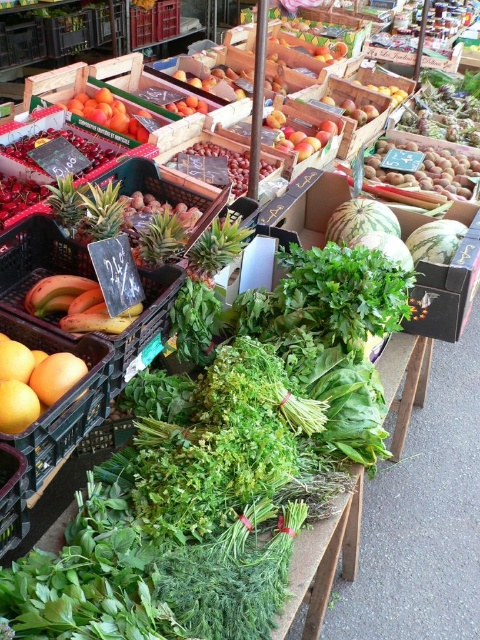
Which of these two, smooth orange tangerines at center or shiny red grapes at center, stands shorter?

smooth orange tangerines at center is shorter.

Who is positioned more to the left, smooth orange tangerines at center or shiny red grapes at center?

From the viewer's perspective, smooth orange tangerines at center appears more on the left side.

Measure the distance between point (78, 99) and camera.

A distance of 7.77 feet exists between point (78, 99) and camera.

At what (x,y) coordinates should I click in order to perform the action: click on smooth orange tangerines at center. Please return your answer as a coordinate pair (x, y). The image size is (480, 640). Looking at the image, I should click on coord(109,113).

This screenshot has height=640, width=480. What do you see at coordinates (424, 168) in the screenshot?
I see `smooth brown nuts at upper right` at bounding box center [424, 168].

Does smooth brown nuts at upper right appear on the right side of green leafy vegetable at center?

Indeed, smooth brown nuts at upper right is positioned on the right side of green leafy vegetable at center.

Is point (418, 186) behind point (36, 196)?

Yes, it is.

The image size is (480, 640). Find the location of `smooth brown nuts at upper right`. smooth brown nuts at upper right is located at coordinates (424, 168).

How distant is smooth brown nuts at upper right from smooth orange at center?

The distance of smooth brown nuts at upper right from smooth orange at center is 3.39 feet.

Who is more forward, (454, 180) or (193, 100)?

Point (454, 180)

You are a GUI agent. You are given a task and a screenshot of the screen. Output one action in this format:
    pyautogui.click(x=<x>, y=<y>)
    Task: Click on the smooth brown nuts at upper right
    This screenshot has width=480, height=640.
    Given the screenshot: What is the action you would take?
    pyautogui.click(x=424, y=168)

The width and height of the screenshot is (480, 640). In order to click on smooth brown nuts at upper right in this screenshot , I will do `click(424, 168)`.